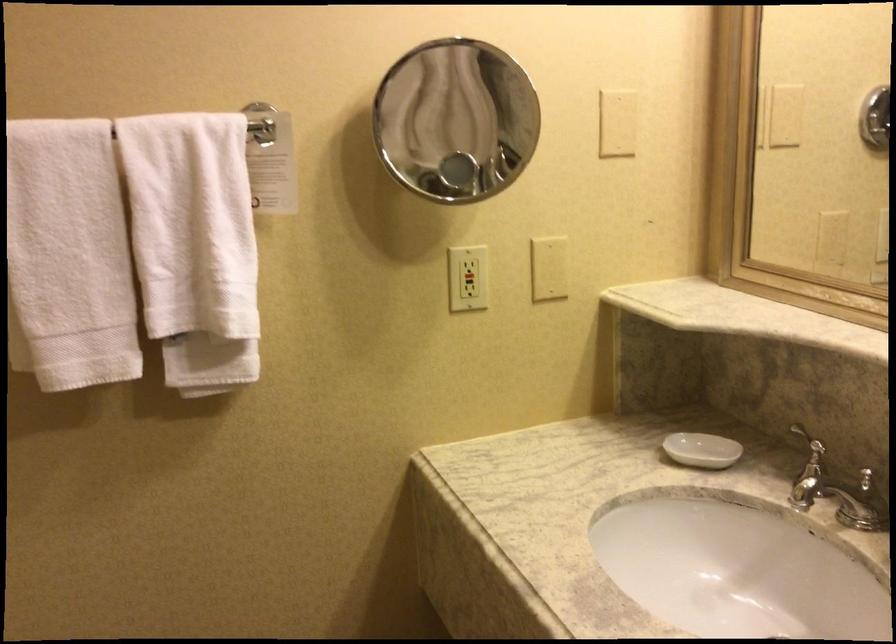
Image resolution: width=896 pixels, height=644 pixels. I want to click on round magnifying mirror, so click(455, 120).